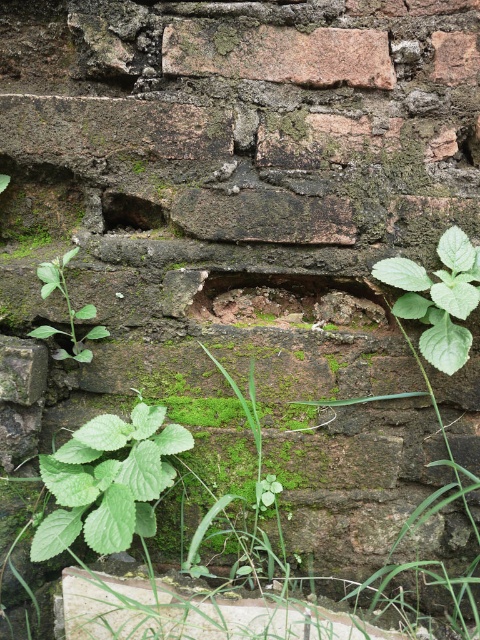
Is green leafy plant at lower left below green leafy plant at lower right?

Correct, green leafy plant at lower left is located below green leafy plant at lower right.

Which is behind, point (37, 536) or point (429, 288)?

The point (429, 288) is behind.

In order to click on green leafy plant at lower left in this screenshot , I will do `click(108, 481)`.

Who is taller, green leafy plant at lower left or rusty stone brick at upper center?

green leafy plant at lower left

Is the position of green leafy plant at lower left more distant than that of rusty stone brick at upper center?

No, it is not.

This screenshot has height=640, width=480. What do you see at coordinates (108, 481) in the screenshot?
I see `green leafy plant at lower left` at bounding box center [108, 481].

The width and height of the screenshot is (480, 640). Identify the location of green leafy plant at lower left. (108, 481).

Does rusty stone brick at upper center have a lesser height compared to green leafy plant at lower right?

Correct, rusty stone brick at upper center is not as tall as green leafy plant at lower right.

Does rusty stone brick at upper center have a greater height compared to green leafy plant at lower right?

No.

I want to click on rusty stone brick at upper center, so click(277, 52).